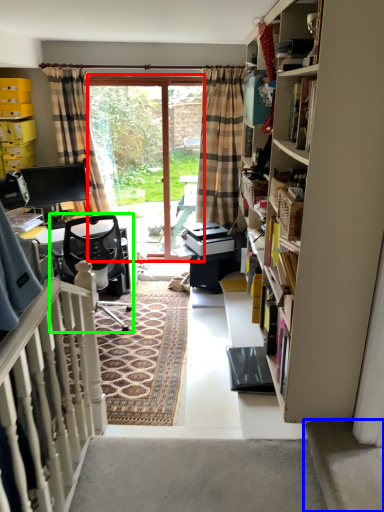
Question: Considering the real-world distances, which object is farthest from screen door (highlighted by a red box)? stairwell (highlighted by a blue box) or chair (highlighted by a green box)?

Choices:
 (A) stairwell
 (B) chair

Answer: (A)